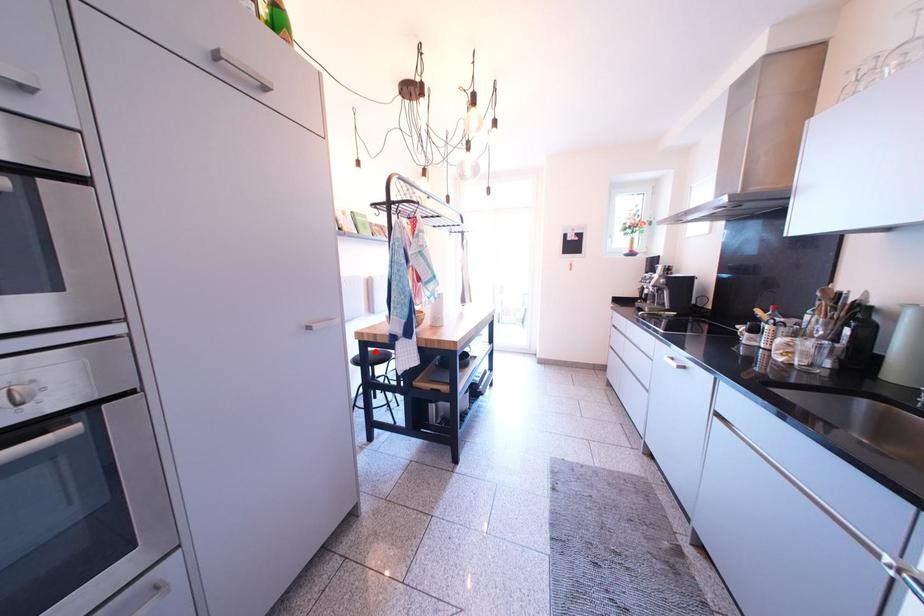
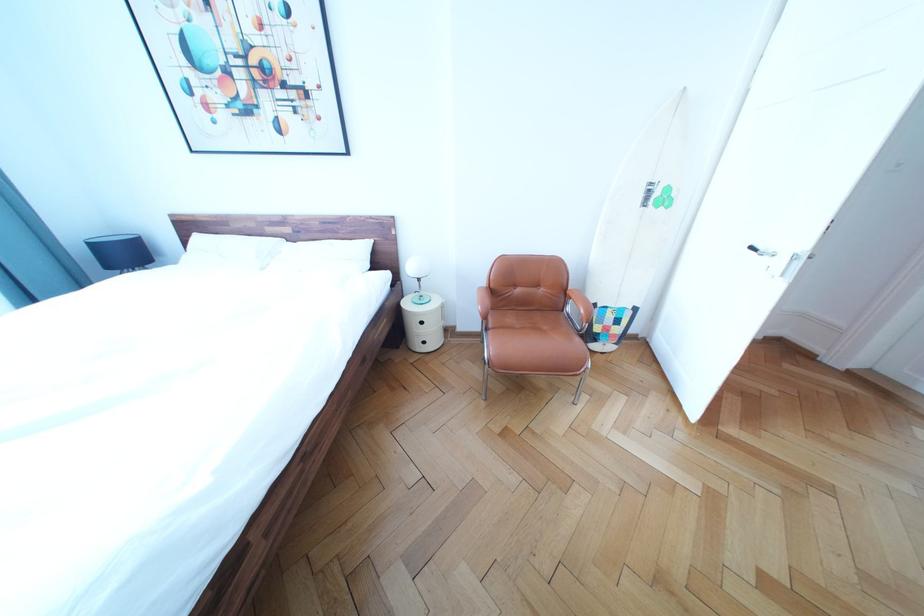
Question: I am providing you with two images of the same scene from different viewpoints. A red point is marked on the first image. Is the red point's position out of view in image 2?

Choices:
 (A) Yes
 (B) No

Answer: (A)